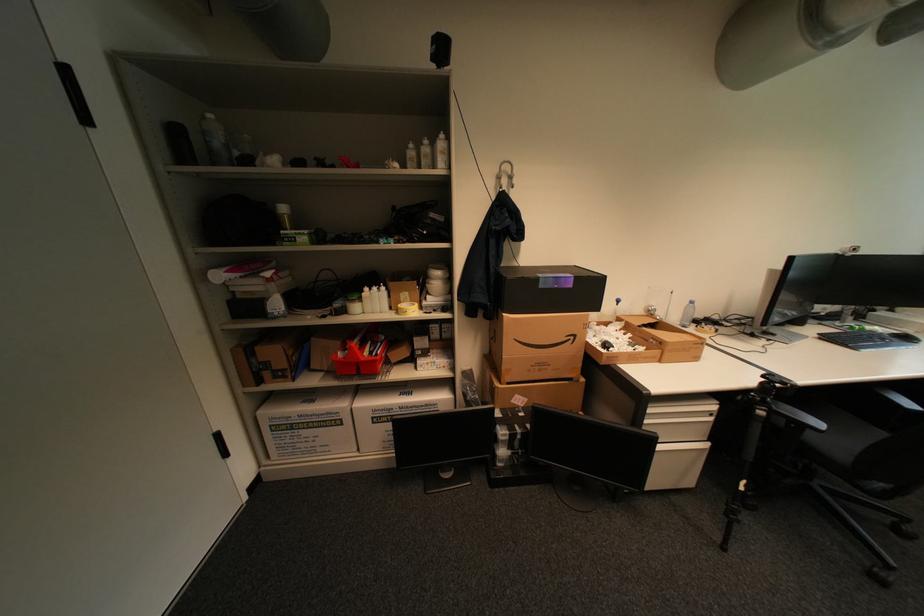
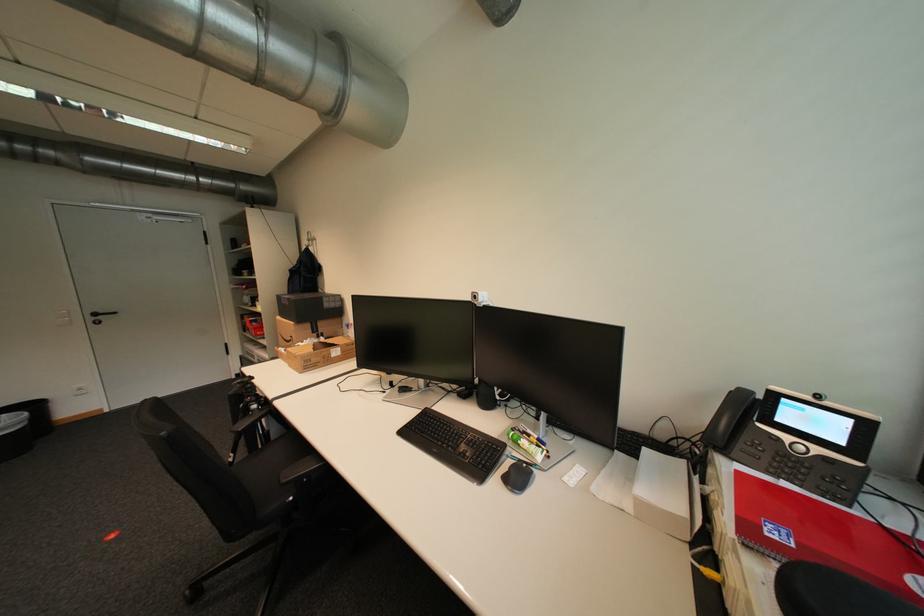
The point at (862, 251) is marked in the first image. Where is the corresponding point in the second image?

(483, 297)